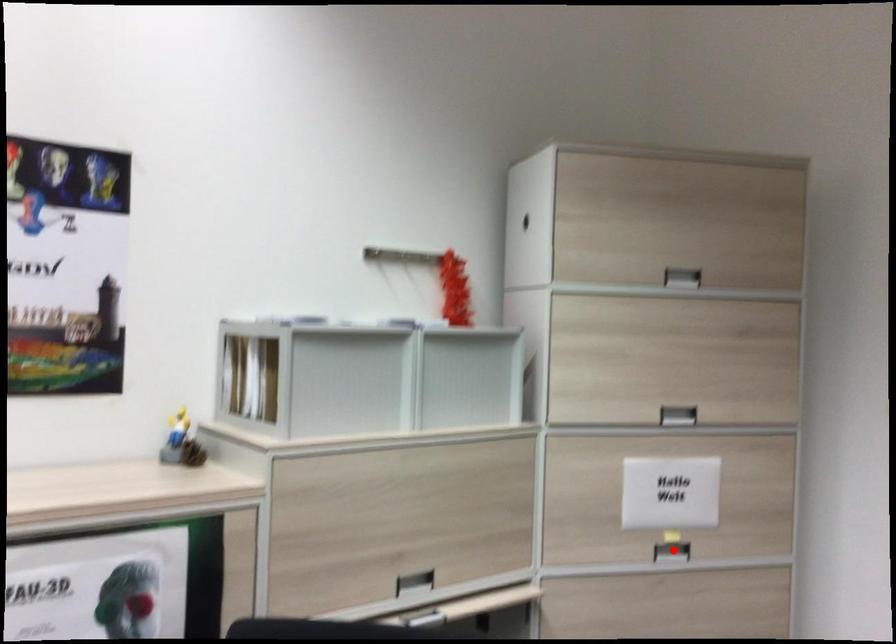
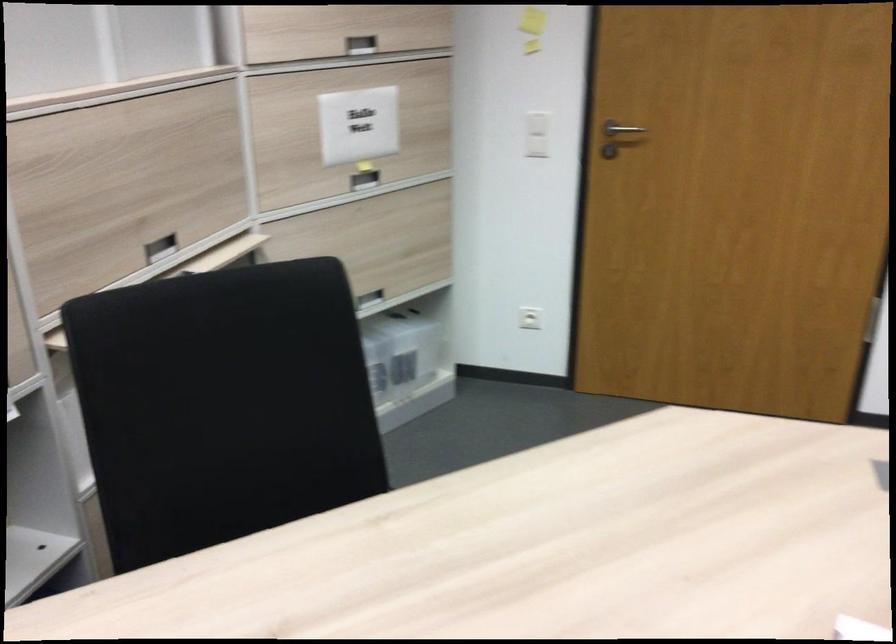
The point at the highlighted location is marked in the first image. Where is the corresponding point in the second image?

(364, 180)